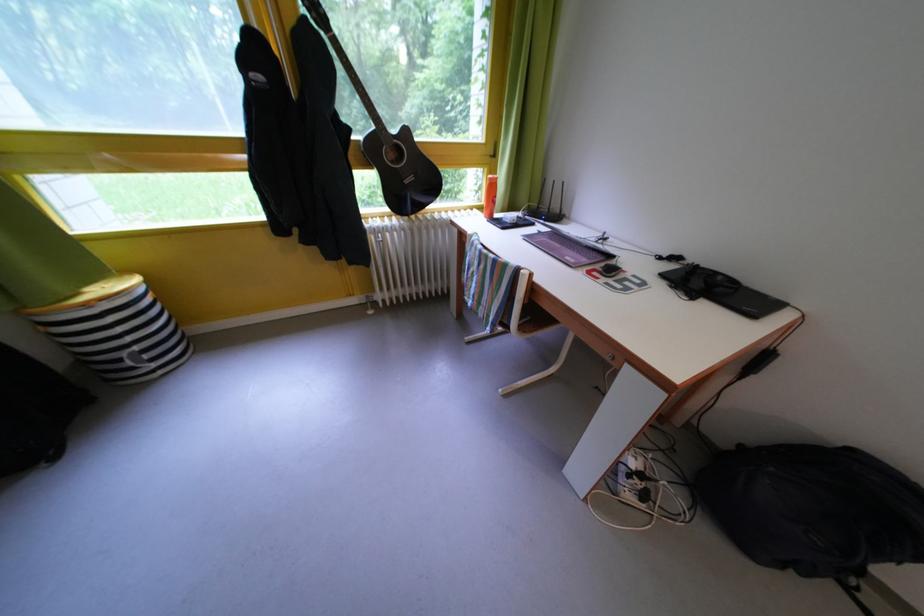
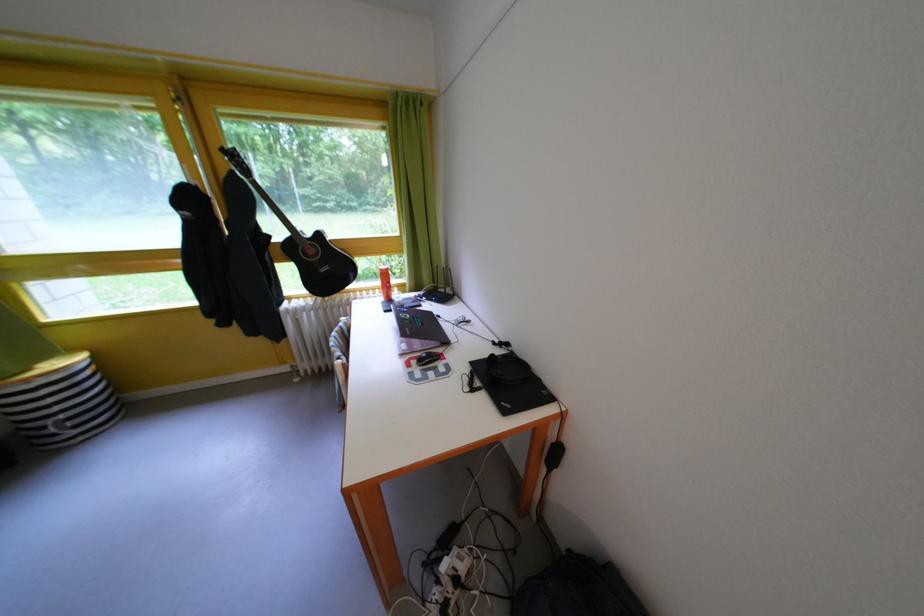
Question: In a continuous first-person perspective shot, in which direction is the camera moving?

Choices:
 (A) Left
 (B) Right
 (C) Forward
 (D) Backward

Answer: (B)